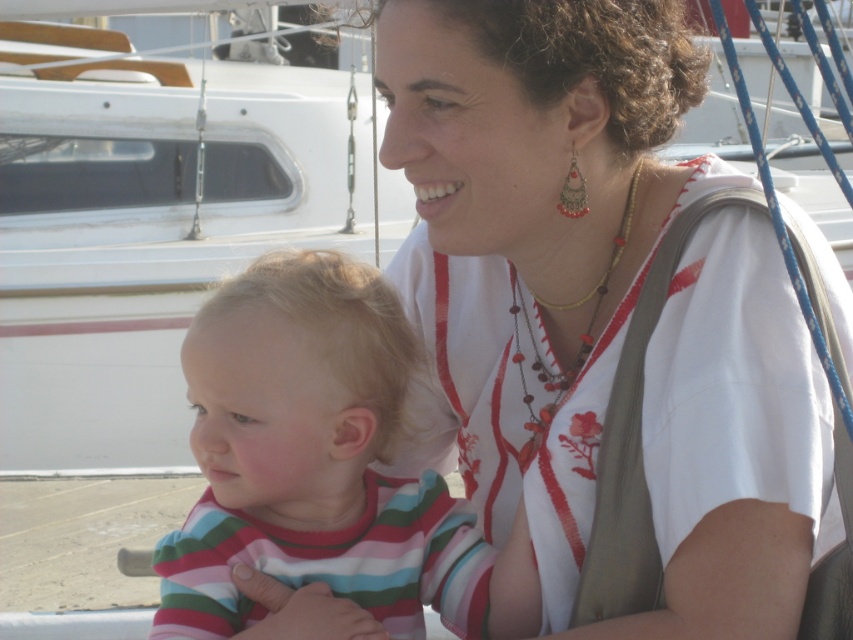
Question: Which point is closer to the camera taking this photo?

Choices:
 (A) (51, 413)
 (B) (474, 252)
 (C) (585, 339)
 (D) (334, 566)

Answer: (B)

Question: Is striped cotton shirt at center positioned in front of multicolored beaded necklace at upper center?

Choices:
 (A) no
 (B) yes

Answer: (B)

Question: Which of the following is the closest to the observer?

Choices:
 (A) striped cotton shirt at center
 (B) white embroidered shirt at upper center

Answer: (B)

Question: From the image, what is the correct spatial relationship of striped cotton shirt at center in relation to multicolored beaded necklace at upper center?

Choices:
 (A) right
 (B) left

Answer: (B)

Question: Observing the image, what is the correct spatial positioning of white plastic boat at upper center in reference to multicolored beaded necklace at upper center?

Choices:
 (A) above
 (B) below

Answer: (A)

Question: Which of the following is the closest to the observer?

Choices:
 (A) white plastic boat at upper center
 (B) white embroidered shirt at upper center
 (C) multicolored beaded necklace at upper center

Answer: (B)